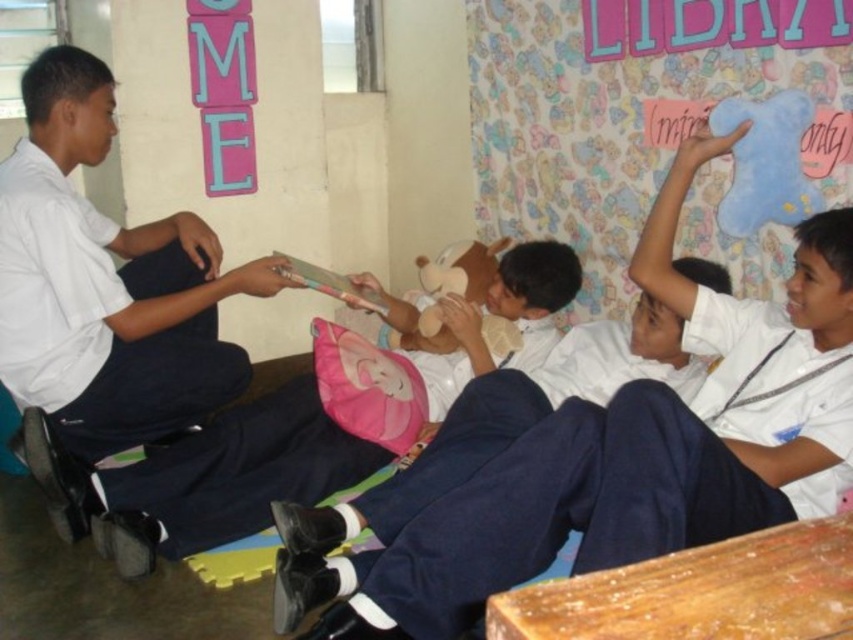
Can you confirm if white matte uniform at left is smaller than white uniform shirt at center?

Correct, white matte uniform at left occupies less space than white uniform shirt at center.

The image size is (853, 640). Identify the location of white matte uniform at left. (106, 282).

Between white matte uniform at center and white matte uniform at left, which one has more height?

white matte uniform at left is taller.

Does white matte uniform at center appear on the left side of white matte uniform at left?

No, white matte uniform at center is not to the left of white matte uniform at left.

Does point (683, 308) come in front of point (129, 432)?

Yes, point (683, 308) is closer to viewer.

Image resolution: width=853 pixels, height=640 pixels. In order to click on white matte uniform at center in this screenshot , I will do `click(645, 444)`.

At what (x,y) coordinates should I click in order to perform the action: click on white matte uniform at center. Please return your answer as a coordinate pair (x, y). Looking at the image, I should click on (645, 444).

Which is in front, point (468, 522) or point (146, 452)?

Point (468, 522) is more forward.

Find the location of a particular element. Image resolution: width=853 pixels, height=640 pixels. white matte uniform at center is located at coordinates (645, 444).